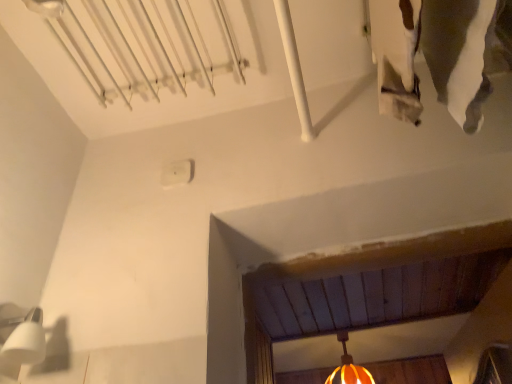
Describe the element at coordinates (348, 368) in the screenshot. The image size is (512, 384). I see `orange striped glass lamp at lower center` at that location.

The height and width of the screenshot is (384, 512). I want to click on orange striped glass lamp at lower center, so click(x=348, y=368).

What is the approximate width of orange striped glass lamp at lower center?

orange striped glass lamp at lower center is 13.36 inches in width.

Image resolution: width=512 pixels, height=384 pixels. In order to click on orange striped glass lamp at lower center in this screenshot , I will do `click(348, 368)`.